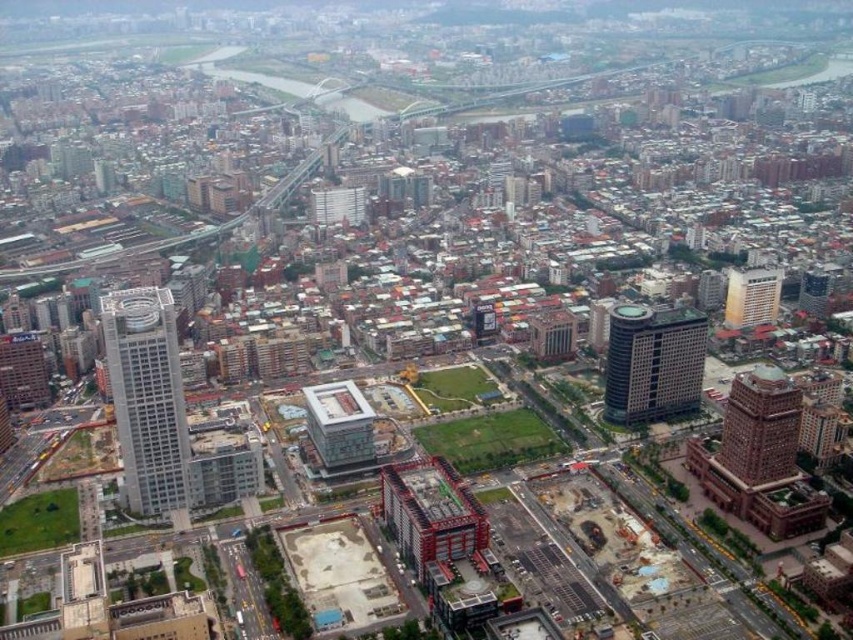
Question: Considering the real-world distances, which object is farthest from the silver metallic skyscraper at left?

Choices:
 (A) matte gray building at center
 (B) white concrete building at center
 (C) matte glass building at center-right
 (D) brown brick building at lower right

Answer: (A)

Question: Which point is closer to the camera?

Choices:
 (A) (346, 224)
 (B) (181, 492)

Answer: (B)

Question: Does matte glass building at center-right have a lesser width compared to white glossy building at upper right?

Choices:
 (A) yes
 (B) no

Answer: (B)

Question: Among these points, which one is farthest from the camera?

Choices:
 (A) (762, 278)
 (B) (795, 465)
 (C) (335, 429)
 (D) (666, 417)

Answer: (A)

Question: Is brown brick building at lower right bigger than matte gray building at center?

Choices:
 (A) no
 (B) yes

Answer: (B)

Question: Can you confirm if silver metallic skyscraper at left is smaller than matte glass building at center-right?

Choices:
 (A) no
 (B) yes

Answer: (A)